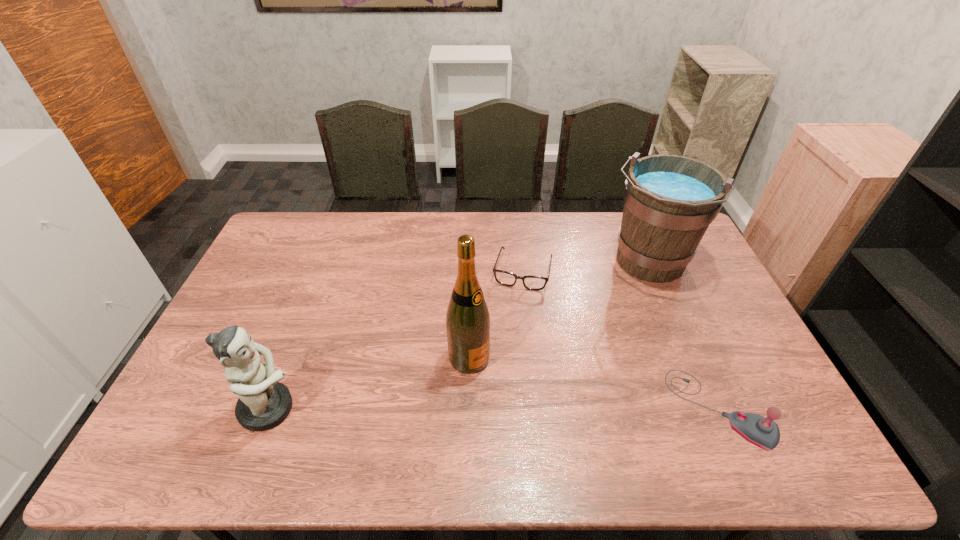
Where is `free space located on the front-facing side of the shortest object`? Image resolution: width=960 pixels, height=540 pixels. free space located on the front-facing side of the shortest object is located at coordinates click(x=493, y=385).

The width and height of the screenshot is (960, 540). Identify the location of vacant region located 0.310m on the front-facing side of the shortest object. (497, 367).

Where is `vacant area situated with a handle on the side of the wine bucket`? The image size is (960, 540). vacant area situated with a handle on the side of the wine bucket is located at coordinates (594, 349).

The height and width of the screenshot is (540, 960). I want to click on free location located with a handle on the side of the wine bucket, so click(588, 359).

Locate an element on the screen. blank area located 0.210m with a handle on the side of the wine bucket is located at coordinates (606, 332).

This screenshot has width=960, height=540. In order to click on free space located 0.060m on the front-facing side of the fourth object from right to left in this screenshot , I will do `click(502, 381)`.

Identify the location of vacant region located on the front-facing side of the fourth object from right to left. (539, 406).

Locate an element on the screen. vacant area situated 0.220m on the front-facing side of the fourth object from right to left is located at coordinates (552, 415).

You are a GUI agent. You are given a task and a screenshot of the screen. Output one action in this format:
    pyautogui.click(x=<x>, y=<y>)
    Task: Click on the object present at the far edge
    This screenshot has height=540, width=960.
    Given the screenshot: What is the action you would take?
    pyautogui.click(x=669, y=200)

Where is `figurine at the near edge`? The image size is (960, 540). figurine at the near edge is located at coordinates (264, 403).